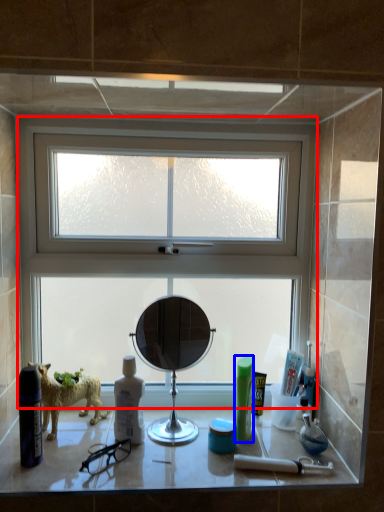
Question: Which object is further to the camera taking this photo, window (highlighted by a red box) or toiletry (highlighted by a blue box)?

Choices:
 (A) window
 (B) toiletry

Answer: (A)